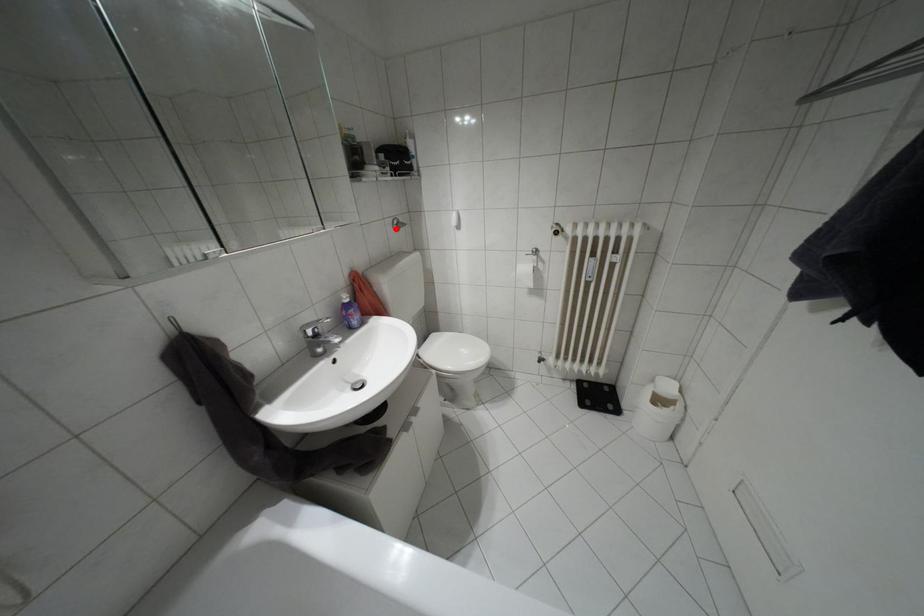
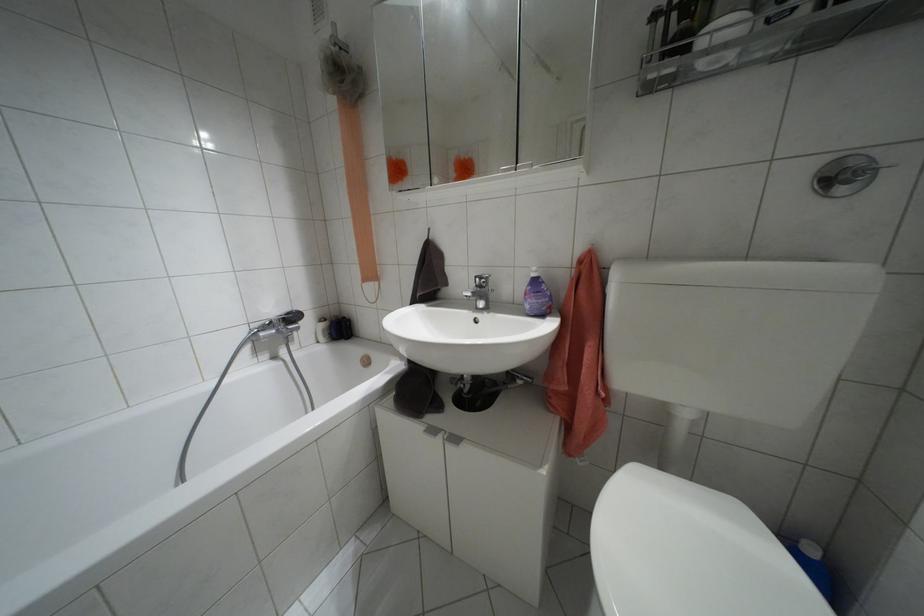
The point at the highlighted location is marked in the first image. Where is the corresponding point in the second image?

(841, 190)